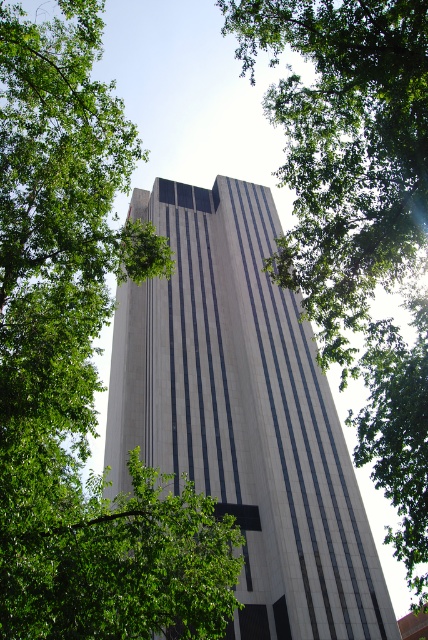
What are the coordinates of the white marble tower at center in the image?

The white marble tower at center is located at coordinates point (243, 416).

From the picture: You are standing in front of the modern building and notice the green leafy tree at center. Based on its position coordinates, can you determine if the tree is closer to the left or right side of the building?

The green leafy tree at center is located at point 0.570 on the x and 0.189 on the y. Since the x coordinate is 0.570, which is closer to 1 than 0, the tree is positioned more to the right side of the building.